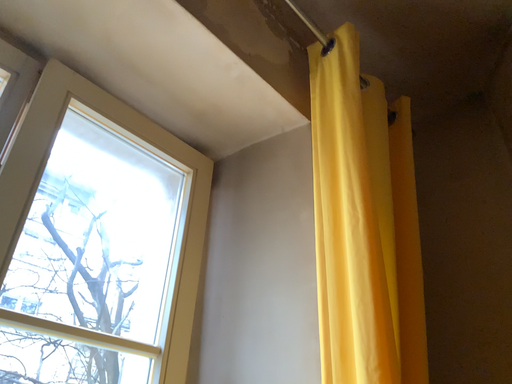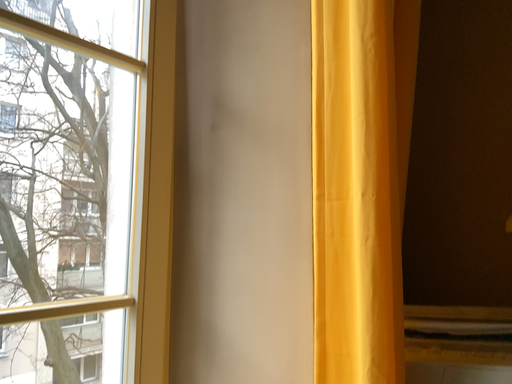
Question: Which way did the camera rotate in the video?

Choices:
 (A) rotated upward
 (B) rotated downward

Answer: (B)